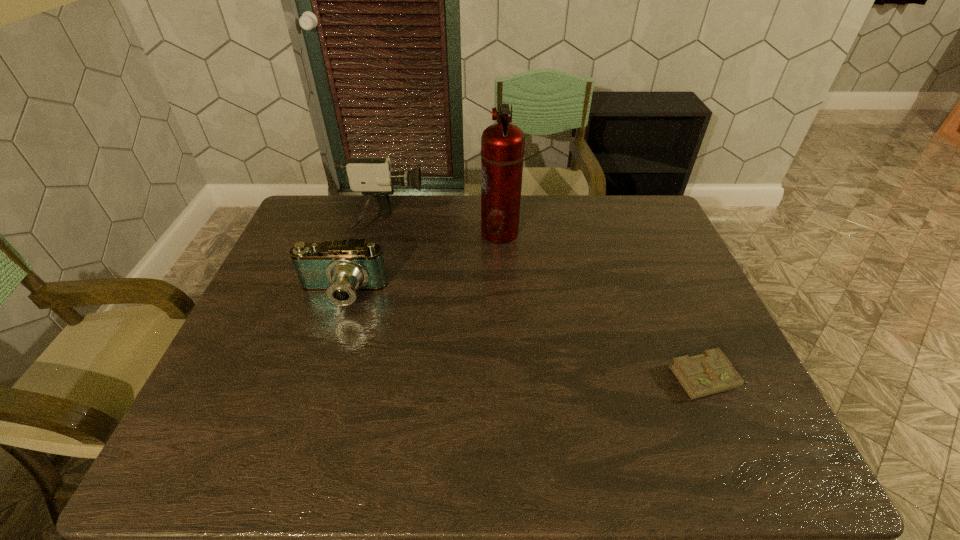
Where is `vacant area that satisfies the following two spatial constraints: 1. on the nozzle side of the third object from left to right; 2. on the right side of the diary`? This screenshot has height=540, width=960. vacant area that satisfies the following two spatial constraints: 1. on the nozzle side of the third object from left to right; 2. on the right side of the diary is located at coordinates (508, 378).

Find the location of a particular element. The width and height of the screenshot is (960, 540). free point that satisfies the following two spatial constraints: 1. on the front-facing side of the nearer camcorder; 2. on the right side of the rightmost object is located at coordinates (315, 378).

Where is `free space that satisfies the following two spatial constraints: 1. on the nozzle side of the tallest object; 2. on the right side of the diary`? This screenshot has width=960, height=540. free space that satisfies the following two spatial constraints: 1. on the nozzle side of the tallest object; 2. on the right side of the diary is located at coordinates (508, 378).

You are a GUI agent. You are given a task and a screenshot of the screen. Output one action in this format:
    pyautogui.click(x=<x>, y=<y>)
    Task: Click on the free location that satisfies the following two spatial constraints: 1. on the recording direction of the farther camcorder; 2. on the back side of the rightmost object
    
    Given the screenshot: What is the action you would take?
    pyautogui.click(x=342, y=378)

Locate an element on the screen. Image resolution: width=960 pixels, height=540 pixels. vacant space that satisfies the following two spatial constraints: 1. on the recording direction of the nearest object; 2. on the left side of the farther camcorder is located at coordinates (342, 378).

You are a GUI agent. You are given a task and a screenshot of the screen. Output one action in this format:
    pyautogui.click(x=<x>, y=<y>)
    Task: Click on the free point that satisfies the following two spatial constraints: 1. on the recording direction of the farther camcorder; 2. on the back side of the diary
    
    Given the screenshot: What is the action you would take?
    pyautogui.click(x=342, y=378)